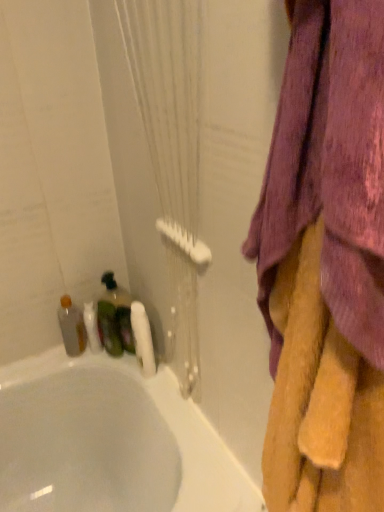
Question: Does white matte toilet paper at lower left lie behind translucent plastic bottle at left, positioned as the 1th bottle in left-to-right order?

Choices:
 (A) no
 (B) yes

Answer: (A)

Question: Does white matte toilet paper at lower left contain translucent plastic bottle at left, positioned as the 1th bottle in left-to-right order?

Choices:
 (A) yes
 (B) no

Answer: (B)

Question: Is white matte toilet paper at lower left taller than translucent plastic bottle at left, positioned as the 1th bottle in left-to-right order?

Choices:
 (A) yes
 (B) no

Answer: (A)

Question: From the image's perspective, is white matte toilet paper at lower left above translucent plastic bottle at left, the second bottle when ordered from right to left?

Choices:
 (A) yes
 (B) no

Answer: (B)

Question: Is white matte toilet paper at lower left smaller than translucent plastic bottle at left, positioned as the 1th bottle in left-to-right order?

Choices:
 (A) no
 (B) yes

Answer: (B)

Question: Considering the positions of soft yellow towel at right and white textured shower curtain at left in the image, is soft yellow towel at right taller or shorter than white textured shower curtain at left?

Choices:
 (A) short
 (B) tall

Answer: (A)

Question: Relative to white textured shower curtain at left, is soft yellow towel at right in front or behind?

Choices:
 (A) front
 (B) behind

Answer: (A)

Question: From the image's perspective, relative to white textured shower curtain at left, is soft yellow towel at right above or below?

Choices:
 (A) below
 (B) above

Answer: (A)

Question: Is soft yellow towel at right wider or thinner than white textured shower curtain at left?

Choices:
 (A) thin
 (B) wide

Answer: (B)

Question: Is soft yellow towel at right inside or outside of purple fabric towel at upper right?

Choices:
 (A) outside
 (B) inside

Answer: (B)

Question: Looking at the image, does soft yellow towel at right seem bigger or smaller compared to purple fabric towel at upper right?

Choices:
 (A) small
 (B) big

Answer: (B)

Question: Relative to purple fabric towel at upper right, is soft yellow towel at right in front or behind?

Choices:
 (A) behind
 (B) front

Answer: (A)

Question: In terms of height, does soft yellow towel at right look taller or shorter compared to purple fabric towel at upper right?

Choices:
 (A) short
 (B) tall

Answer: (B)

Question: Is point (72, 314) closer or farther from the camera than point (347, 175)?

Choices:
 (A) closer
 (B) farther

Answer: (B)

Question: In the image, is translucent plastic bottle at left, the second bottle when ordered from right to left, positioned in front of or behind purple fabric towel at upper right?

Choices:
 (A) front
 (B) behind

Answer: (B)